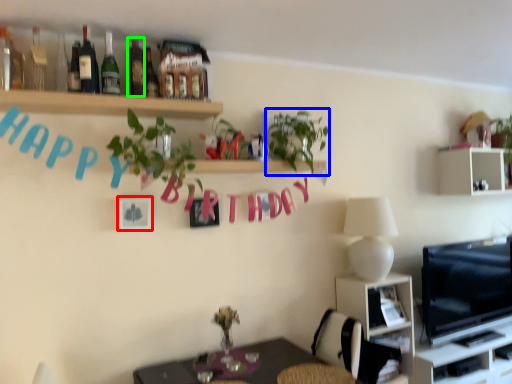
Question: Estimate the real-world distances between objects in this image. Which object is closer to picture frame (highlighted by a red box), plant (highlighted by a blue box) or bottle (highlighted by a green box)?

Choices:
 (A) plant
 (B) bottle

Answer: (B)